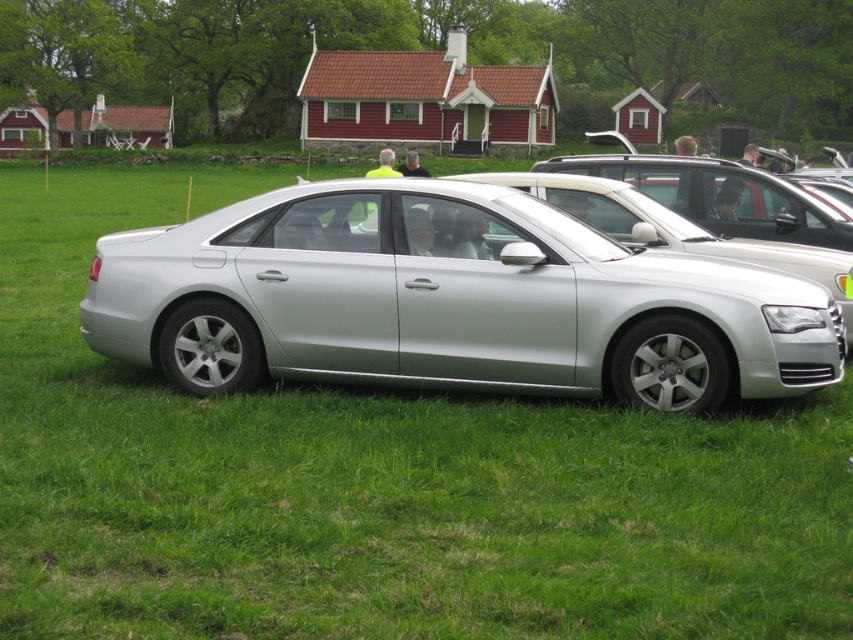
You are standing at the point marked by the coordinates point (450, 301) in the image. What object are you directly at?

The point (450, 301) marks the silver metallic sedan at center, so you are directly at the silver metallic sedan at center.

You are a delivery person needing to park your vehicle in the parking lot behind the silver metallic sedan at center and the satin silver car at center. The parking lot has a width of 10 feet. Can both vehicles fit side by side in the parking lot?

The silver metallic sedan at center and the satin silver car at center are 9.20 feet apart. Since the parking lot is 10 feet wide, there is enough space to fit both vehicles side by side with 0.8 feet of clearance remaining.

You are a photographer trying to capture both the silver metallic sedan at center and the satin silver car at center in a single frame. Given their sizes, which car will appear bigger in the photo?

The silver metallic sedan at center will appear bigger in the photo because it has a larger size compared to the satin silver car at center.